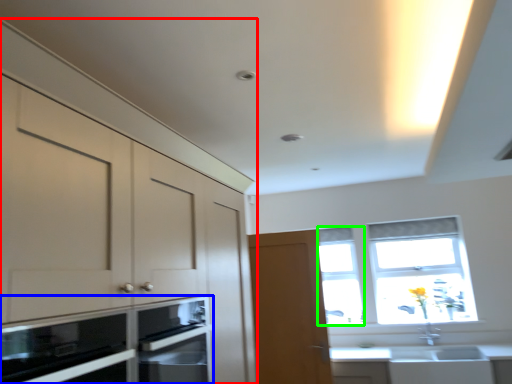
Question: Estimate the real-world distances between objects in this image. Which object is farther from cabinetry (highlighted by a red box), microwave oven (highlighted by a blue box) or window (highlighted by a green box)?

Choices:
 (A) microwave oven
 (B) window

Answer: (B)